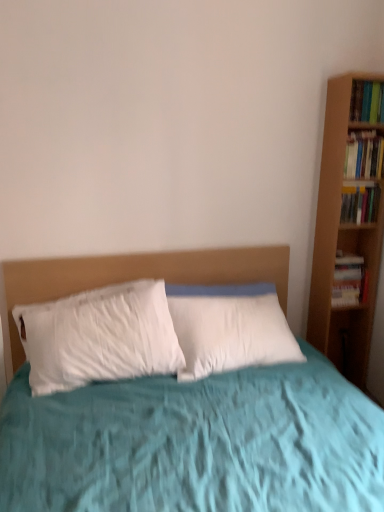
Question: Is hardcover book at upper right, marked as the first book in a top-to-bottom arrangement, inside or outside of hardcover book at right, which is the 3th book in top-to-bottom order?

Choices:
 (A) inside
 (B) outside

Answer: (B)

Question: Does point (377, 119) appear closer or farther from the camera than point (357, 202)?

Choices:
 (A) farther
 (B) closer

Answer: (B)

Question: Based on their relative distances, which object is farther from the hardcover book at right, which appears as the first book when ordered from the bottom?

Choices:
 (A) hardcover book at upper right, placed as the fourth book when sorted from bottom to top
 (B) hardcover book at right, the third book ordered from the bottom
 (C) hardcover book at right, which is the 3th book in top-to-bottom order

Answer: (A)

Question: Which of these objects is positioned farthest from the hardcover book at right, arranged as the fourth book when viewed from the top?

Choices:
 (A) hardcover book at right, arranged as the 2th book when viewed from the top
 (B) hardcover book at upper right, marked as the first book in a top-to-bottom arrangement
 (C) hardcover book at right, which is the 3th book in top-to-bottom order

Answer: (B)